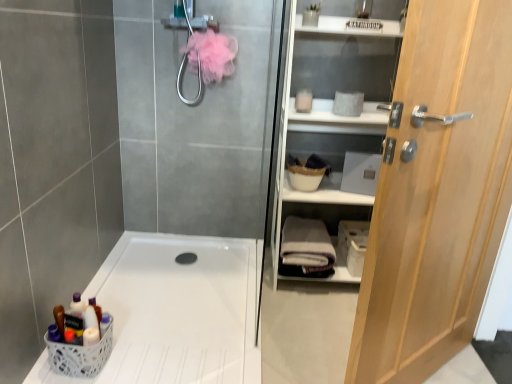
Question: Considering the positions of white plastic bath at lower left and white plastic basket at lower left in the image, is white plastic bath at lower left bigger or smaller than white plastic basket at lower left?

Choices:
 (A) small
 (B) big

Answer: (B)

Question: Considering the relative positions of white plastic bath at lower left and white plastic basket at lower left in the image provided, is white plastic bath at lower left to the left or to the right of white plastic basket at lower left?

Choices:
 (A) right
 (B) left

Answer: (A)

Question: Which of these objects is positioned closest to the light wood door at right?

Choices:
 (A) white plastic basket at lower left
 (B) white matte shelf at right
 (C) white plastic bath at lower left
 (D) white cotton bath towel at center

Answer: (B)

Question: Based on their relative distances, which object is farther from the white plastic basket at lower left?

Choices:
 (A) light wood door at right
 (B) white matte shelf at right
 (C) white cotton bath towel at center
 (D) white plastic bath at lower left

Answer: (B)